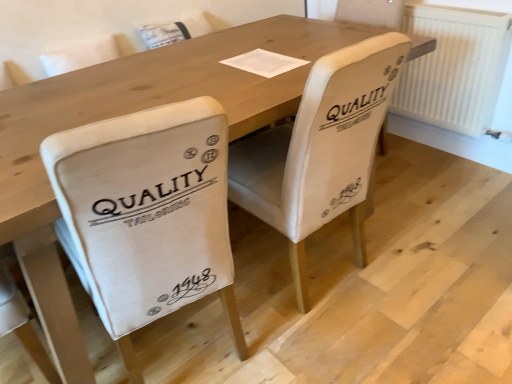
Question: Is white fabric chair at center, which ranks as the 2th chair in left-to-right order, with beige fabric chair at center, acting as the 1th chair starting from the left?

Choices:
 (A) no
 (B) yes

Answer: (A)

Question: Is white fabric chair at center, which ranks as the 2th chair in left-to-right order, looking in the opposite direction of beige fabric chair at center, acting as the 1th chair starting from the left?

Choices:
 (A) yes
 (B) no

Answer: (B)

Question: From a real-world perspective, is white fabric chair at center, the 1th chair when ordered from right to left, over beige fabric chair at center, which appears as the 2th chair when viewed from the right?

Choices:
 (A) no
 (B) yes

Answer: (A)

Question: Is white fabric chair at center, which ranks as the 2th chair in left-to-right order, taller than beige fabric chair at center, which appears as the 2th chair when viewed from the right?

Choices:
 (A) yes
 (B) no

Answer: (A)

Question: Can you confirm if white fabric chair at center, which ranks as the 2th chair in left-to-right order, is shorter than beige fabric chair at center, acting as the 1th chair starting from the left?

Choices:
 (A) yes
 (B) no

Answer: (B)

Question: Would you say white paper at center is to the left or to the right of beige fabric chair at center, acting as the 1th chair starting from the left, in the picture?

Choices:
 (A) right
 (B) left

Answer: (A)

Question: Is white paper at center inside or outside of beige fabric chair at center, which appears as the 2th chair when viewed from the right?

Choices:
 (A) inside
 (B) outside

Answer: (B)

Question: From the image's perspective, relative to beige fabric chair at center, which appears as the 2th chair when viewed from the right, is white paper at center above or below?

Choices:
 (A) below
 (B) above

Answer: (B)

Question: Looking at the image, does white paper at center seem bigger or smaller compared to beige fabric chair at center, which appears as the 2th chair when viewed from the right?

Choices:
 (A) big
 (B) small

Answer: (B)

Question: Visually, is beige fabric chair at center, acting as the 1th chair starting from the left, positioned to the left or to the right of white fabric chair at center, which ranks as the 2th chair in left-to-right order?

Choices:
 (A) right
 (B) left

Answer: (B)

Question: From the image's perspective, is beige fabric chair at center, acting as the 1th chair starting from the left, above or below white fabric chair at center, which ranks as the 2th chair in left-to-right order?

Choices:
 (A) above
 (B) below

Answer: (B)

Question: Does point (186, 142) appear closer or farther from the camera than point (364, 130)?

Choices:
 (A) farther
 (B) closer

Answer: (B)

Question: From a real-world perspective, relative to white fabric chair at center, which ranks as the 2th chair in left-to-right order, is beige fabric chair at center, acting as the 1th chair starting from the left, vertically above or below?

Choices:
 (A) below
 (B) above

Answer: (B)

Question: Is white paper at center to the left or to the right of white textured radiator at right in the image?

Choices:
 (A) left
 (B) right

Answer: (A)

Question: Is white paper at center inside the boundaries of white textured radiator at right, or outside?

Choices:
 (A) outside
 (B) inside

Answer: (A)